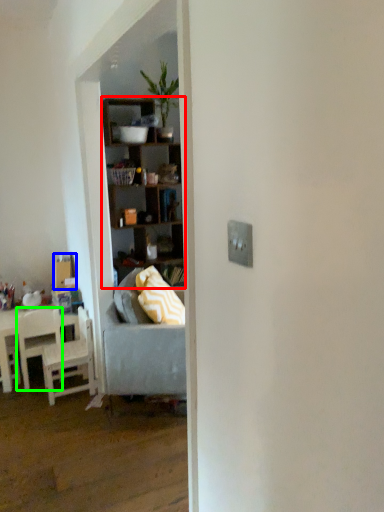
Question: Estimate the real-world distances between objects in this image. Which object is farther from shelf (highlighted by a red box), box (highlighted by a blue box) or chair (highlighted by a green box)?

Choices:
 (A) box
 (B) chair

Answer: (B)